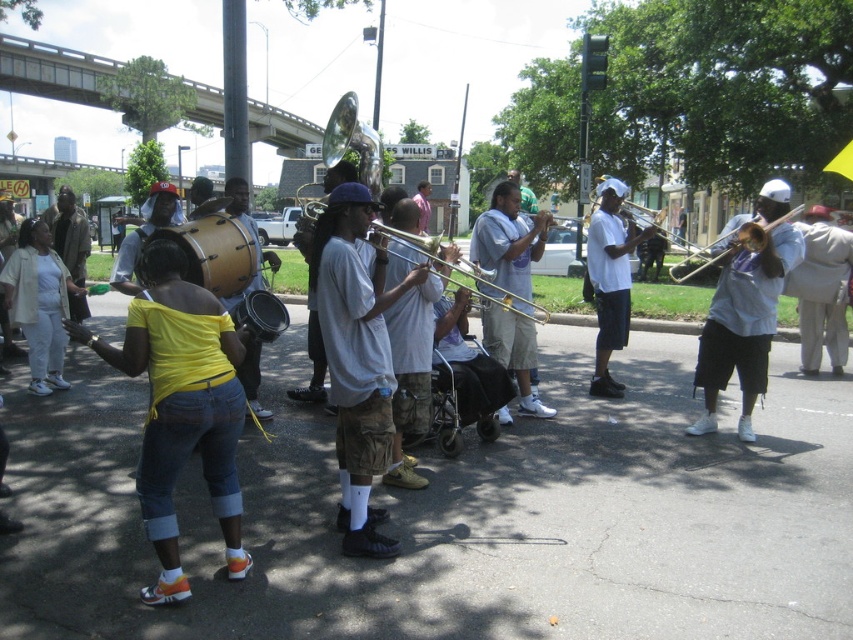
Question: Can you confirm if light blue cotton shirt at center is thinner than light beige suit at center?

Choices:
 (A) yes
 (B) no

Answer: (A)

Question: Can you confirm if yellow fabric shirt at center is positioned to the right of matte gold drum at center?

Choices:
 (A) yes
 (B) no

Answer: (A)

Question: Estimate the real-world distances between objects in this image. Which object is farther from the light beige suit at center?

Choices:
 (A) white matte trombone at right
 (B) matte black jacket at left

Answer: (B)

Question: Which of the following is the closest to the observer?

Choices:
 (A) light beige suit at center
 (B) matte brown drum at center

Answer: (B)

Question: Which point is closer to the camera?

Choices:
 (A) shiny gold trombone at center
 (B) white matte trombone at center
 (C) matte gold drum at center
 (D) yellow fabric shirt at center

Answer: (D)

Question: Can you confirm if white matte trombone at right is smaller than white cotton pants at center?

Choices:
 (A) no
 (B) yes

Answer: (B)